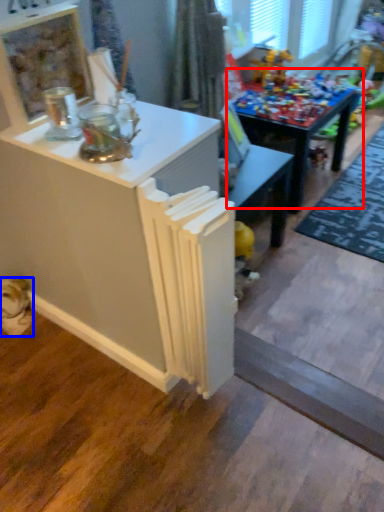
Question: Which of the following is the farthest to the observer, table (highlighted by a red box) or animal (highlighted by a blue box)?

Choices:
 (A) table
 (B) animal

Answer: (A)